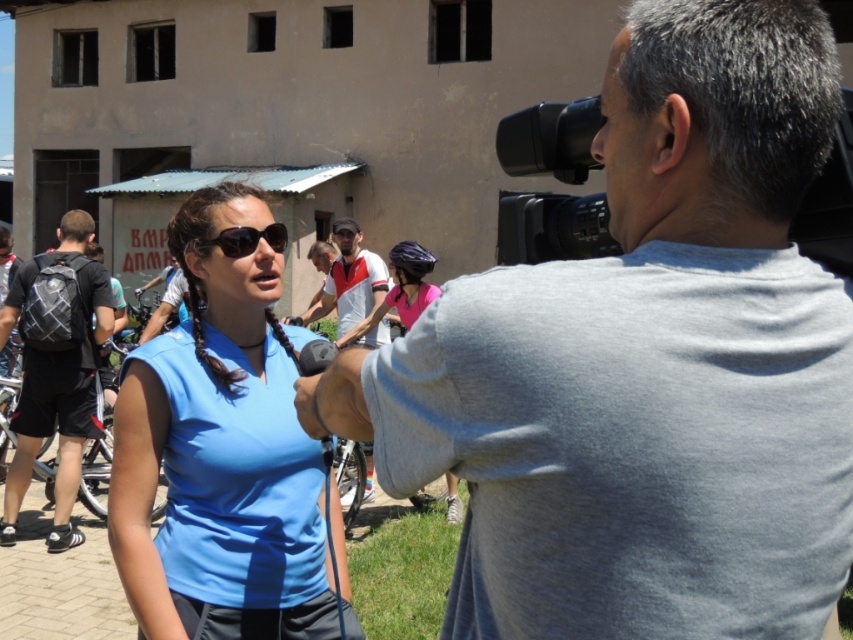
You are standing at the point labeled as point [531,131] and want to walk to the point labeled as point [675,636]. Which direction should you move relative to your current position?

You should move towards the direction closer to the viewer since point [675,636] is closer to the viewer than point [531,131].